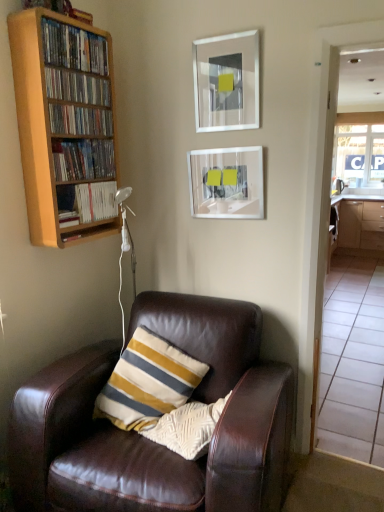
Question: Can you see transparent glass window at right touching silver metallic picture frame at upper center, the 1th picture frame when ordered from top to bottom?

Choices:
 (A) yes
 (B) no

Answer: (B)

Question: Can you confirm if transparent glass window at right is bigger than silver metallic picture frame at upper center, the 1th picture frame when ordered from top to bottom?

Choices:
 (A) yes
 (B) no

Answer: (A)

Question: From a real-world perspective, is transparent glass window at right located beneath silver metallic picture frame at upper center, the second picture frame ordered from the bottom?

Choices:
 (A) yes
 (B) no

Answer: (A)

Question: Can you confirm if transparent glass window at right is taller than silver metallic picture frame at upper center, the second picture frame ordered from the bottom?

Choices:
 (A) no
 (B) yes

Answer: (B)

Question: Is transparent glass window at right facing away from silver metallic picture frame at upper center, the 1th picture frame when ordered from top to bottom?

Choices:
 (A) yes
 (B) no

Answer: (B)

Question: From the image's perspective, is transparent glass window at right above silver metallic picture frame at upper center, the second picture frame ordered from the bottom?

Choices:
 (A) yes
 (B) no

Answer: (A)

Question: Is the depth of white glossy cabinetry at right greater than that of transparent glass door at right?

Choices:
 (A) no
 (B) yes

Answer: (B)

Question: Considering the relative sizes of white glossy cabinetry at right and transparent glass door at right in the image provided, is white glossy cabinetry at right shorter than transparent glass door at right?

Choices:
 (A) yes
 (B) no

Answer: (A)

Question: Can you confirm if white glossy cabinetry at right is positioned to the right of transparent glass door at right?

Choices:
 (A) no
 (B) yes

Answer: (B)

Question: Is white glossy cabinetry at right far away from transparent glass door at right?

Choices:
 (A) no
 (B) yes

Answer: (A)

Question: Could you tell me if white glossy cabinetry at right is turned towards transparent glass door at right?

Choices:
 (A) no
 (B) yes

Answer: (B)

Question: Can you confirm if white glossy cabinetry at right is wider than transparent glass door at right?

Choices:
 (A) yes
 (B) no

Answer: (A)

Question: Could brown leather chair at lower left be considered to be inside wooden bookcase at left?

Choices:
 (A) no
 (B) yes

Answer: (A)